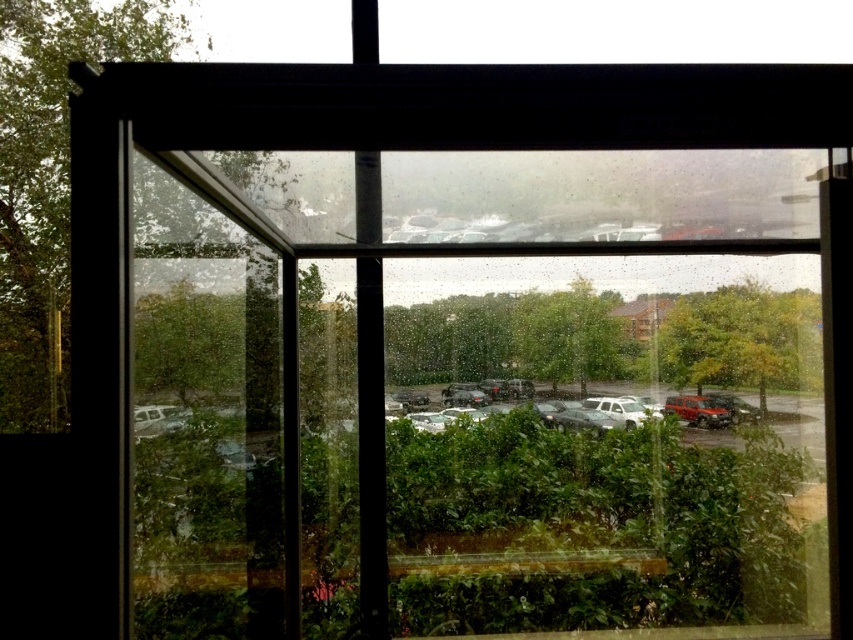
You are a delivery person trying to park your vehicle in the parking lot shown in the image. You see the matte red suv at lower right and the white matte truck at center. Which vehicle is blocking your path to the parking spot?

The matte red suv at lower right is positioned over the white matte truck at center, so the matte red suv at lower right is blocking the path to the parking spot.

You are standing at the window and want to estimate how far the matte silver suv at center is from you. Can you determine the distance?

The matte silver suv at center is 8.61 meters away from the camera, so it is approximately 8.61 meters away from you.

You are standing in a room and looking through the window. You see a matte silver suv at center and a matte red suv at lower right. Which one is nearer to you?

The matte silver suv at center is closer to the viewer than the matte red suv at lower right.